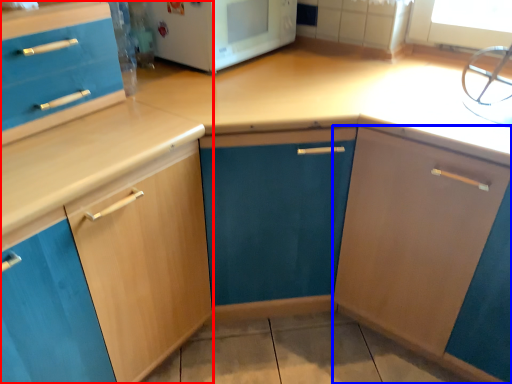
Question: Which point is closer to the camera, cabinetry (highlighted by a red box) or cabinetry (highlighted by a blue box)?

Choices:
 (A) cabinetry
 (B) cabinetry

Answer: (A)